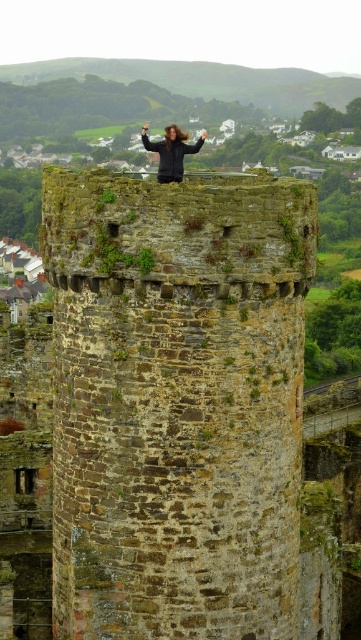
Question: Can you confirm if brown stone tower at center is positioned to the right of dark brown hair at top?

Choices:
 (A) yes
 (B) no

Answer: (A)

Question: Which point is closer to the camera?

Choices:
 (A) brown stone tower at center
 (B) dark brown hair at top

Answer: (A)

Question: Does brown stone tower at center have a smaller size compared to dark brown hair at top?

Choices:
 (A) no
 (B) yes

Answer: (B)

Question: Where is brown stone tower at center located in relation to dark brown hair at top in the image?

Choices:
 (A) below
 (B) above

Answer: (A)